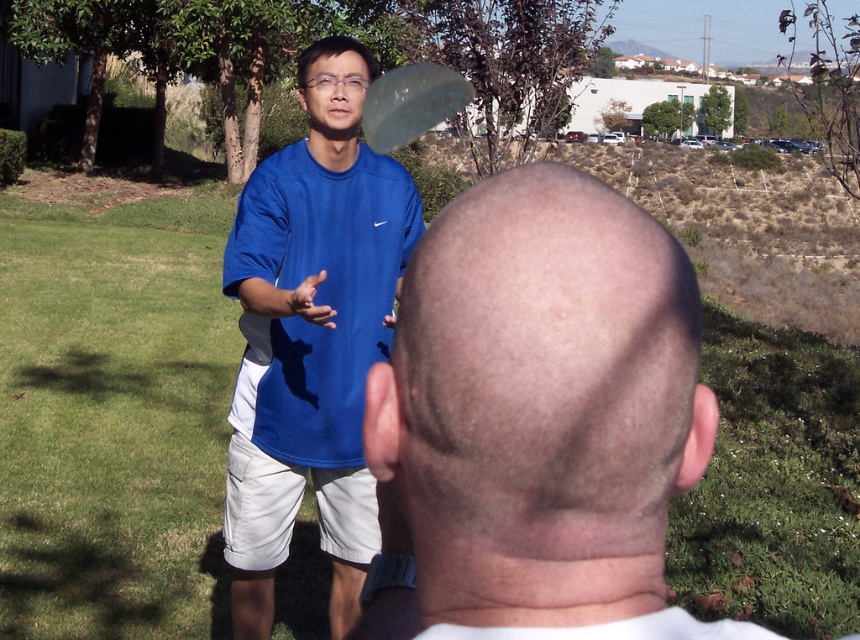
Question: Does blue matte shirt at upper left appear over blue matte shirt at center?

Choices:
 (A) yes
 (B) no

Answer: (A)

Question: Which object appears closest to the camera in this image?

Choices:
 (A) transparent plastic frisbee at upper center
 (B) blue matte shirt at upper left

Answer: (B)

Question: Is blue matte shirt at center thinner than transparent plastic frisbee at upper center?

Choices:
 (A) yes
 (B) no

Answer: (A)

Question: Which of the following is the farthest from the observer?

Choices:
 (A) (673, 419)
 (B) (369, 136)
 (C) (260, 291)

Answer: (B)

Question: Estimate the real-world distances between objects in this image. Which object is closer to the blue matte shirt at upper left?

Choices:
 (A) transparent plastic frisbee at upper center
 (B) blue matte shirt at center

Answer: (B)

Question: Does blue matte shirt at upper left appear on the left side of blue matte shirt at center?

Choices:
 (A) no
 (B) yes

Answer: (A)